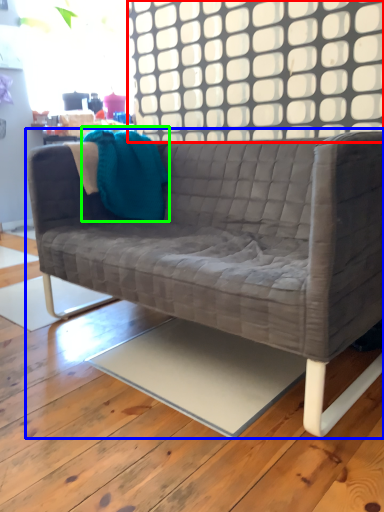
Question: Which is farther away from window (highlighted by a red box)? studio couch (highlighted by a blue box) or throw pillow (highlighted by a green box)?

Choices:
 (A) studio couch
 (B) throw pillow

Answer: (A)